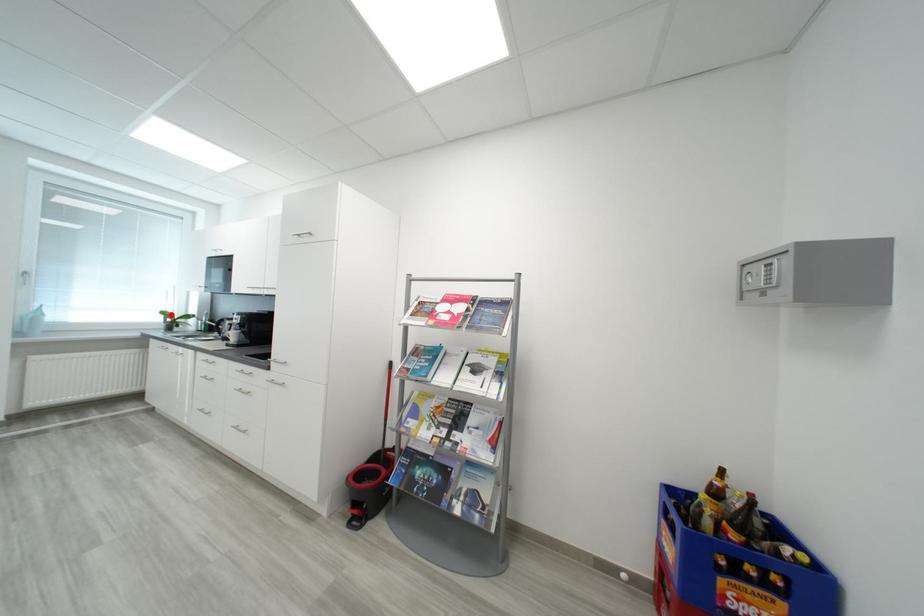
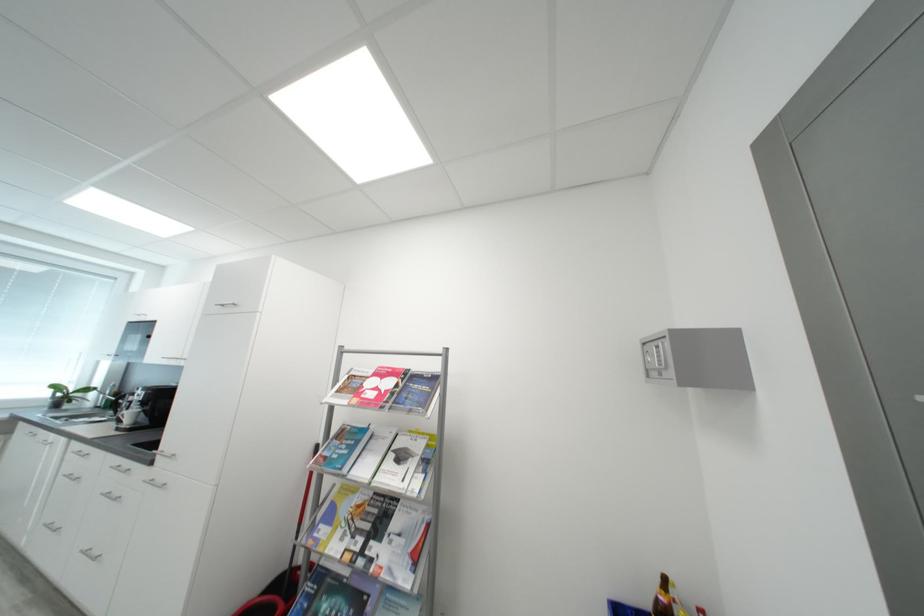
In the second image, find the point that corresponds to the highlighted location in the first image.

(62, 389)